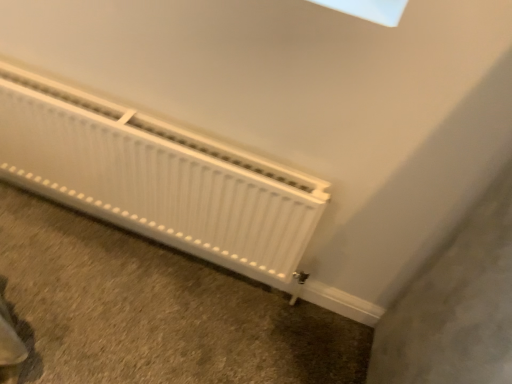
Question: Should I look upward or downward to see white matte radiator at lower left?

Choices:
 (A) up
 (B) down

Answer: (B)

Question: Can you confirm if white matte radiator at lower left is wider than white matte radiator at lower left?

Choices:
 (A) no
 (B) yes

Answer: (B)

Question: Can you see white matte radiator at lower left touching white matte radiator at lower left?

Choices:
 (A) no
 (B) yes

Answer: (A)

Question: Is white matte radiator at lower left completely or partially inside white matte radiator at lower left?

Choices:
 (A) yes
 (B) no

Answer: (B)

Question: Does white matte radiator at lower left have a larger size compared to white matte radiator at lower left?

Choices:
 (A) yes
 (B) no

Answer: (B)

Question: Can you confirm if white matte radiator at lower left is thinner than white matte radiator at lower left?

Choices:
 (A) no
 (B) yes

Answer: (A)

Question: Does white matte radiator at lower left have a greater height compared to white matte radiator at lower left?

Choices:
 (A) no
 (B) yes

Answer: (A)

Question: Is white matte radiator at lower left bigger than white matte radiator at lower left?

Choices:
 (A) yes
 (B) no

Answer: (A)

Question: From a real-world perspective, is white matte radiator at lower left positioned over white matte radiator at lower left based on gravity?

Choices:
 (A) no
 (B) yes

Answer: (B)

Question: Can you confirm if white matte radiator at lower left is shorter than white matte radiator at lower left?

Choices:
 (A) yes
 (B) no

Answer: (B)

Question: Is white matte radiator at lower left to the right of white matte radiator at lower left from the viewer's perspective?

Choices:
 (A) yes
 (B) no

Answer: (A)

Question: Is white matte radiator at lower left further to camera compared to white matte radiator at lower left?

Choices:
 (A) no
 (B) yes

Answer: (A)

Question: Can you confirm if white matte radiator at lower left is positioned to the left of white matte radiator at lower left?

Choices:
 (A) no
 (B) yes

Answer: (A)

Question: Looking at the image, does white matte radiator at lower left seem bigger or smaller compared to white matte radiator at lower left?

Choices:
 (A) big
 (B) small

Answer: (B)